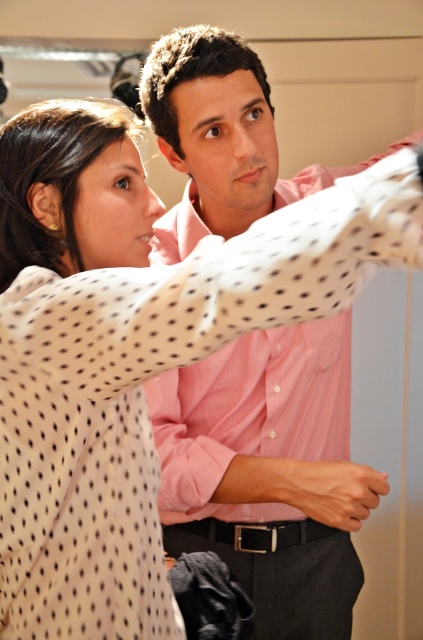
Question: Is polka dot blouse at upper left wider than pink cotton shirt at center?

Choices:
 (A) yes
 (B) no

Answer: (B)

Question: Which object is closer to the camera taking this photo?

Choices:
 (A) polka dot blouse at upper left
 (B) pink cotton shirt at center

Answer: (A)

Question: Which point is farther to the camera?

Choices:
 (A) pink cotton shirt at center
 (B) polka dot blouse at upper left

Answer: (A)

Question: Is polka dot blouse at upper left wider than pink cotton shirt at center?

Choices:
 (A) yes
 (B) no

Answer: (B)

Question: Does polka dot blouse at upper left appear over pink cotton shirt at center?

Choices:
 (A) no
 (B) yes

Answer: (B)